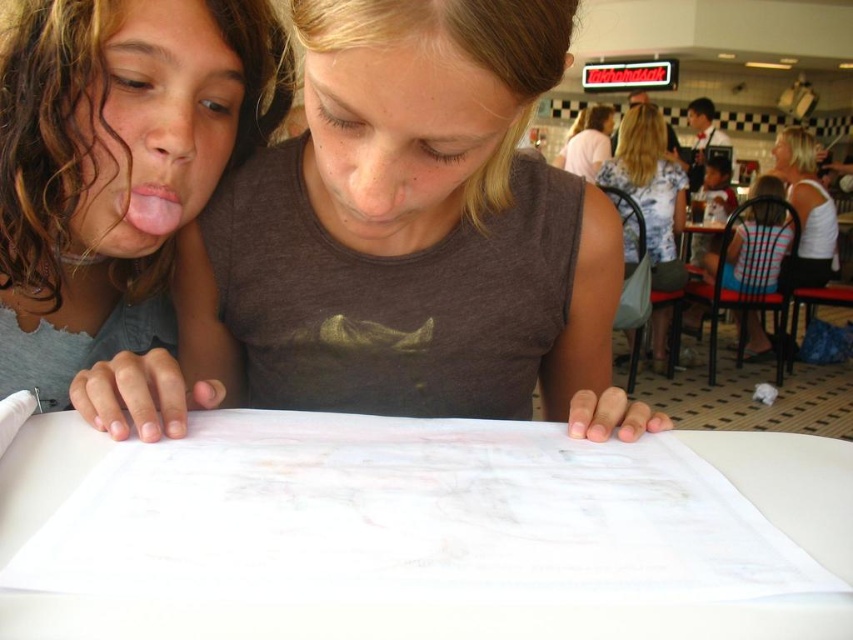
You are a photographer standing in front of the table. You want to take a closeup photo of the matte gray shirt at center. The camera you are using has a minimum focusing distance of 20 inches. Will you be able to take the photo without moving closer?

The matte gray shirt at center is 20.59 inches away from viewer. Since the minimum focusing distance is 20 inches, you can take the photo without moving closer because the distance is within the camera

You are a fashion designer observing two shirts in the image. The shirts are the floral blouse at right and the white fabric shirt at upper right. Which of these two shirts has a narrower width?

The floral blouse at right is thinner than the white fabric shirt at upper right, so the floral blouse at right has a narrower width.

You are a fashion designer observing two shirts on a table in a casual dining scene. The shirts are the matte gray shirt at center and the striped fabric shirt at right. Which shirt takes up more area on the table?

The striped fabric shirt at right takes up more area on the table than the matte gray shirt at center because the matte gray shirt at center occupies less space than striped fabric shirt at right.